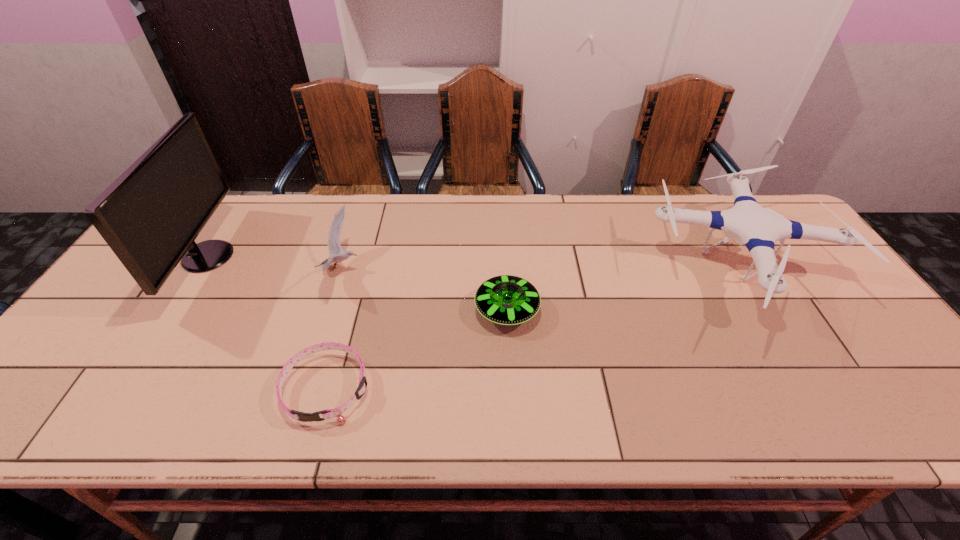
The width and height of the screenshot is (960, 540). I want to click on vacant space located on the left of the drone, so click(581, 269).

The height and width of the screenshot is (540, 960). Identify the location of free spot located at the tip of the beak of the gull. (393, 269).

What are the coordinates of `vacant position located on the left of the second shortest object` in the screenshot? It's located at (455, 310).

Where is `computer monitor present at the far edge`? computer monitor present at the far edge is located at coordinates (151, 214).

Identify the location of drone situated at the far edge. The width and height of the screenshot is (960, 540). (748, 223).

The width and height of the screenshot is (960, 540). In order to click on gull present at the far edge in this screenshot , I will do `click(334, 247)`.

Find the location of `object positioned at the near edge`. object positioned at the near edge is located at coordinates (337, 412).

I want to click on object that is at the left edge, so click(x=151, y=214).

Find the location of a particular element. object at the right edge is located at coordinates (748, 223).

Find the location of a particular element. This screenshot has height=540, width=960. object present at the far left corner is located at coordinates (151, 214).